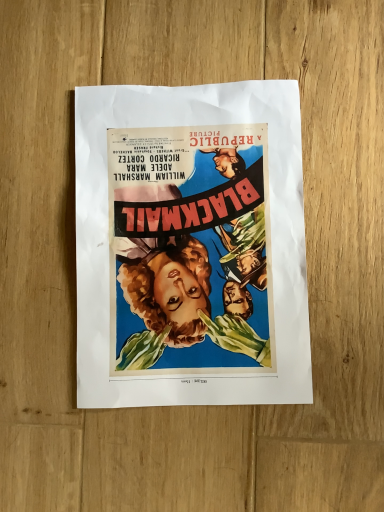
The image size is (384, 512). Identify the location of matte paper poster at center. (271, 234).

Image resolution: width=384 pixels, height=512 pixels. Describe the element at coordinates (271, 234) in the screenshot. I see `matte paper poster at center` at that location.

Image resolution: width=384 pixels, height=512 pixels. What are the coordinates of `matte paper poster at center` in the screenshot? It's located at (271, 234).